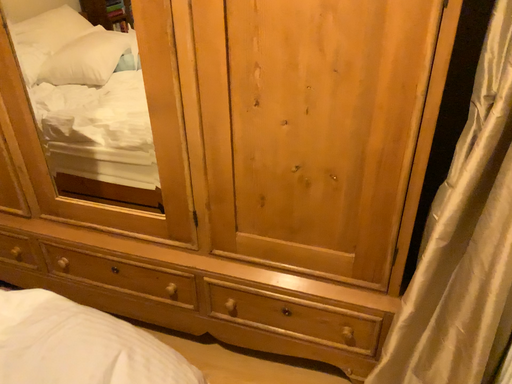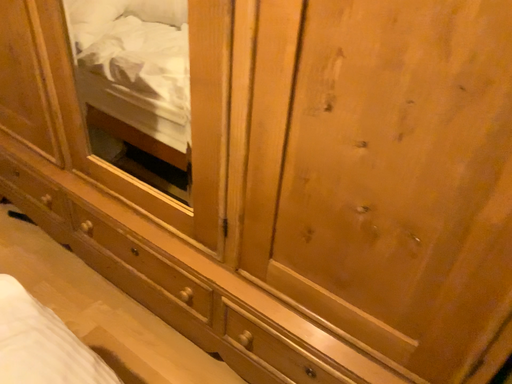
Question: Which way did the camera rotate in the video?

Choices:
 (A) rotated right
 (B) rotated left

Answer: (B)